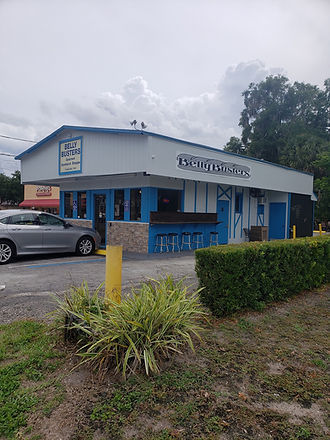
Where is `stool`? stool is located at coordinates (161, 238), (173, 238), (185, 236), (198, 236), (214, 236).